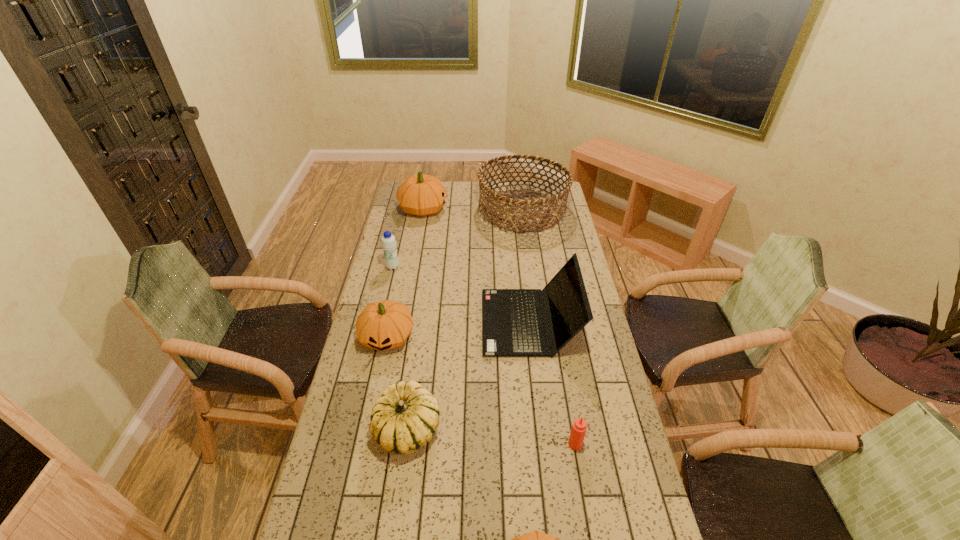
What are the coordinates of `the tallest gourd` in the screenshot? It's located at (421, 195).

Where is `the biggest orange gourd`? The width and height of the screenshot is (960, 540). the biggest orange gourd is located at coordinates (421, 195).

This screenshot has height=540, width=960. In order to click on basket in this screenshot , I will do `click(545, 216)`.

The width and height of the screenshot is (960, 540). Identify the location of black laptop computer. click(x=512, y=324).

This screenshot has height=540, width=960. I want to click on the third farthest object, so click(x=388, y=242).

Locate an element on the screen. water bottle is located at coordinates (388, 242).

At what (x,y) coordinates should I click in order to perform the action: click on the second biggest orange gourd. Please return your answer as a coordinate pair (x, y). This screenshot has width=960, height=540. Looking at the image, I should click on (383, 325).

Where is `the second nearest orange gourd`? The height and width of the screenshot is (540, 960). the second nearest orange gourd is located at coordinates (383, 325).

Where is `the second nearest gourd`? This screenshot has width=960, height=540. the second nearest gourd is located at coordinates (405, 418).

Find the location of `Tabasco sauce`. Tabasco sauce is located at coordinates (579, 427).